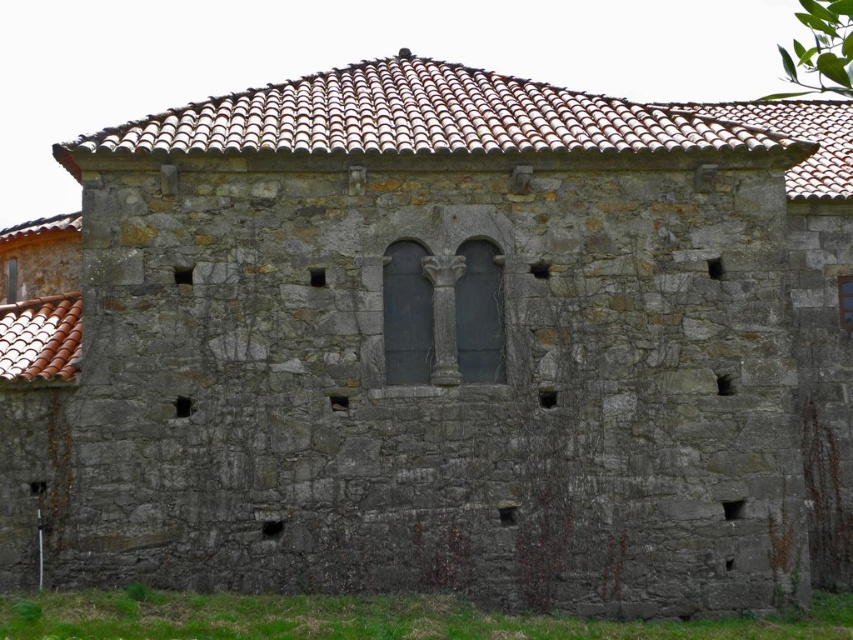
Can you confirm if smooth stone column at center is wider than transparent glass window at center?

Correct, the width of smooth stone column at center exceeds that of transparent glass window at center.

Is smooth stone column at center bigger than transparent glass window at center?

Correct, smooth stone column at center is larger in size than transparent glass window at center.

Between point (409, 358) and point (844, 317), which one is positioned behind?

Point (844, 317)

Identify the location of smooth stone column at center. The image size is (853, 640). (409, 316).

Does brown clay tiles at upper center appear on the left side of smooth stone column at center?

Incorrect, brown clay tiles at upper center is not on the left side of smooth stone column at center.

Which is more to the left, brown clay tiles at upper center or smooth stone column at center?

Positioned to the left is smooth stone column at center.

Is point (828, 147) closer to viewer compared to point (399, 332)?

No.

Identify the location of brown clay tiles at upper center. The height and width of the screenshot is (640, 853). (480, 122).

Consider the image. Between brown clay tiles at upper center and transparent glass window at center, which one appears on the left side from the viewer's perspective?

From the viewer's perspective, brown clay tiles at upper center appears more on the left side.

Is point (395, 65) closer to viewer compared to point (850, 323)?

That is False.

Is point (758, 100) behind point (840, 284)?

Yes, it is.

I want to click on brown clay tiles at upper center, so click(x=480, y=122).